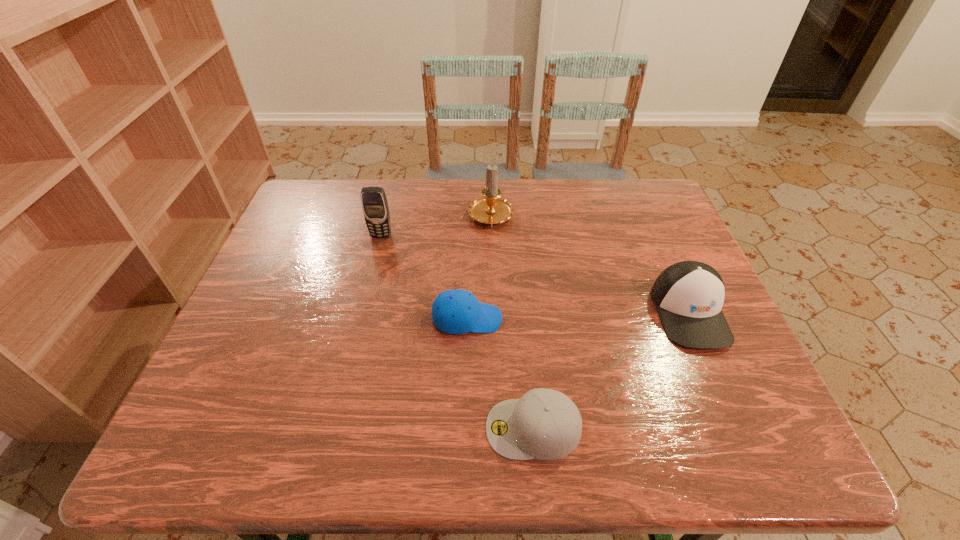
What are the coordinates of `candle` in the screenshot? It's located at (491, 209).

Image resolution: width=960 pixels, height=540 pixels. I want to click on the leftmost object, so click(375, 208).

What are the coordinates of `the rightmost object` in the screenshot? It's located at (688, 295).

Identify the location of the rightmost cap. This screenshot has height=540, width=960. (688, 295).

Where is `the nearest cap`? This screenshot has height=540, width=960. the nearest cap is located at coordinates (545, 424).

Locate an element on the screen. The height and width of the screenshot is (540, 960). vacant space situated 0.130m on the back of the candle is located at coordinates (490, 179).

I want to click on free spot located on the front face of the cellular telephone, so click(371, 277).

This screenshot has width=960, height=540. I want to click on free location located on the front panel of the tallest cap, so click(733, 411).

Where is `free spot located on the front-facing side of the nearest object`? free spot located on the front-facing side of the nearest object is located at coordinates (324, 428).

Where is `vacant space located 0.160m on the front-facing side of the nearest object`? This screenshot has height=540, width=960. vacant space located 0.160m on the front-facing side of the nearest object is located at coordinates (402, 428).